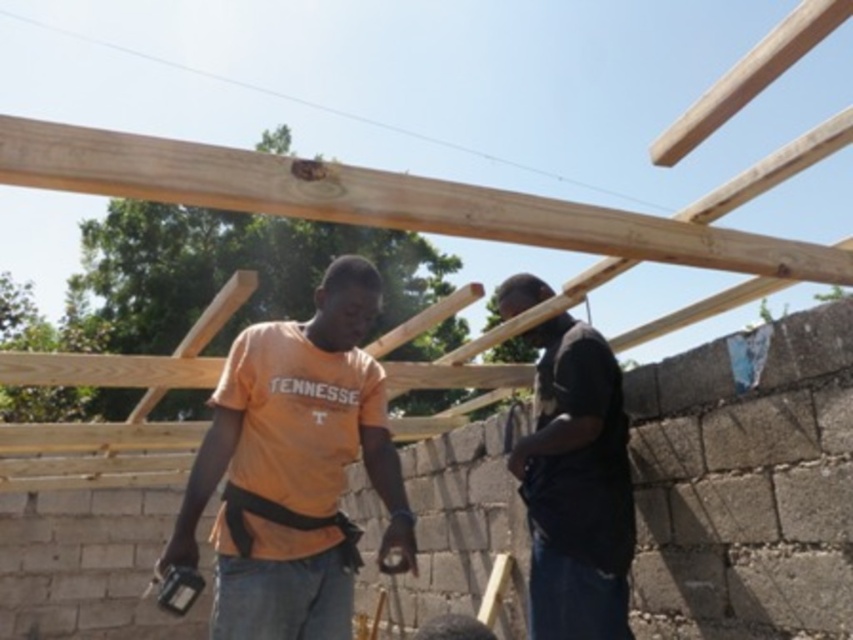
Is orange cotton shirt at center thinner than natural wood beam at upper center?

Indeed, orange cotton shirt at center has a lesser width compared to natural wood beam at upper center.

The image size is (853, 640). Describe the element at coordinates (292, 472) in the screenshot. I see `orange cotton shirt at center` at that location.

Identify the location of orange cotton shirt at center. (292, 472).

Can you confirm if natural wood beam at upper center is positioned below black matte shirt at center?

Incorrect, natural wood beam at upper center is not positioned below black matte shirt at center.

I want to click on natural wood beam at upper center, so click(381, 198).

Measure the distance between natural wood beam at upper center and camera.

A distance of 4.69 feet exists between natural wood beam at upper center and camera.

Find the location of a particular element. natural wood beam at upper center is located at coordinates (381, 198).

Can you confirm if orange cotton shirt at center is thinner than black matte shirt at center?

Incorrect, orange cotton shirt at center's width is not less than black matte shirt at center's.

Can you confirm if orange cotton shirt at center is positioned to the left of black matte shirt at center?

Indeed, orange cotton shirt at center is positioned on the left side of black matte shirt at center.

This screenshot has height=640, width=853. What do you see at coordinates (292, 472) in the screenshot? I see `orange cotton shirt at center` at bounding box center [292, 472].

This screenshot has height=640, width=853. I want to click on orange cotton shirt at center, so click(292, 472).